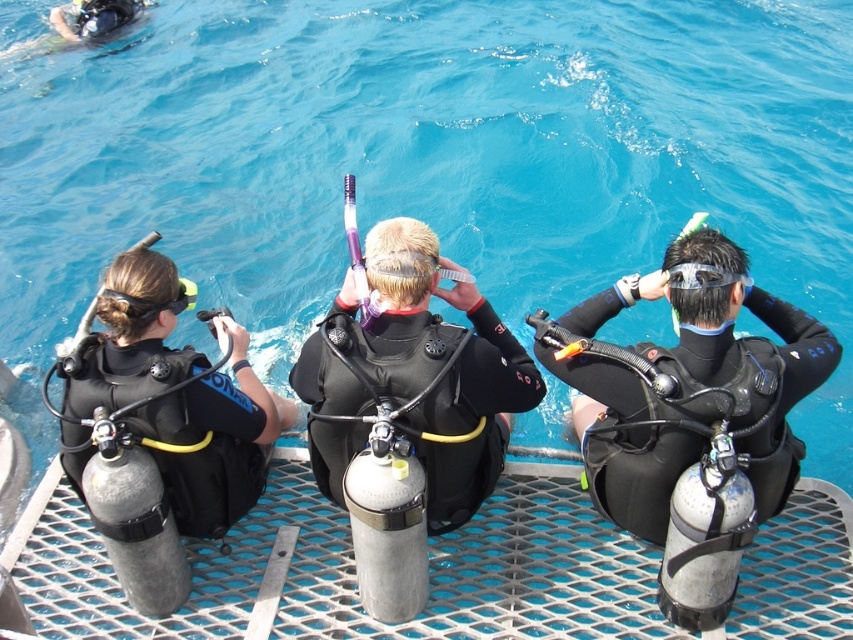
Is black matte wetsuit at right to the left of black matte wetsuit at left from the viewer's perspective?

In fact, black matte wetsuit at right is to the right of black matte wetsuit at left.

Does black matte wetsuit at right have a larger size compared to black matte wetsuit at left?

Indeed, black matte wetsuit at right has a larger size compared to black matte wetsuit at left.

Is point (703, 230) farther from camera compared to point (154, 426)?

That is True.

This screenshot has height=640, width=853. Identify the location of black matte wetsuit at right. (691, 384).

Image resolution: width=853 pixels, height=640 pixels. I want to click on black matte wetsuit at center, so click(437, 365).

Based on the photo, between black matte wetsuit at center and black matte wetsuit at left, which one has more height?

With more height is black matte wetsuit at center.

Is point (323, 376) positioned behind point (265, 460)?

No, (323, 376) is in front of (265, 460).

Where is `black matte wetsuit at center`? This screenshot has width=853, height=640. black matte wetsuit at center is located at coordinates (437, 365).

Does black matte wetsuit at right appear over black matte wetsuit at center?

Actually, black matte wetsuit at right is below black matte wetsuit at center.

Measure the distance between black matte wetsuit at right and black matte wetsuit at center.

1.18 meters

Locate an element on the screen. The image size is (853, 640). black matte wetsuit at right is located at coordinates (691, 384).

Identify the location of black matte wetsuit at right. The height and width of the screenshot is (640, 853). (691, 384).